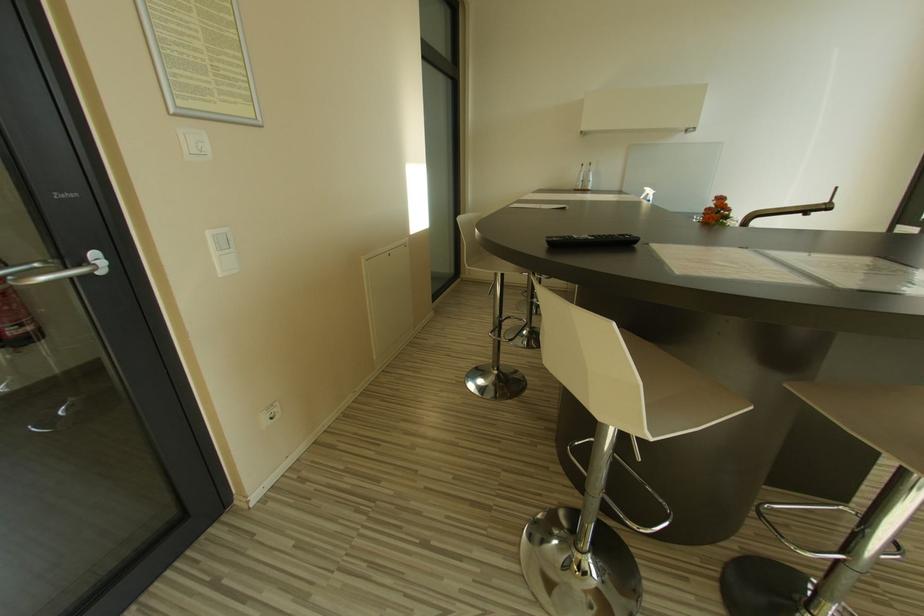
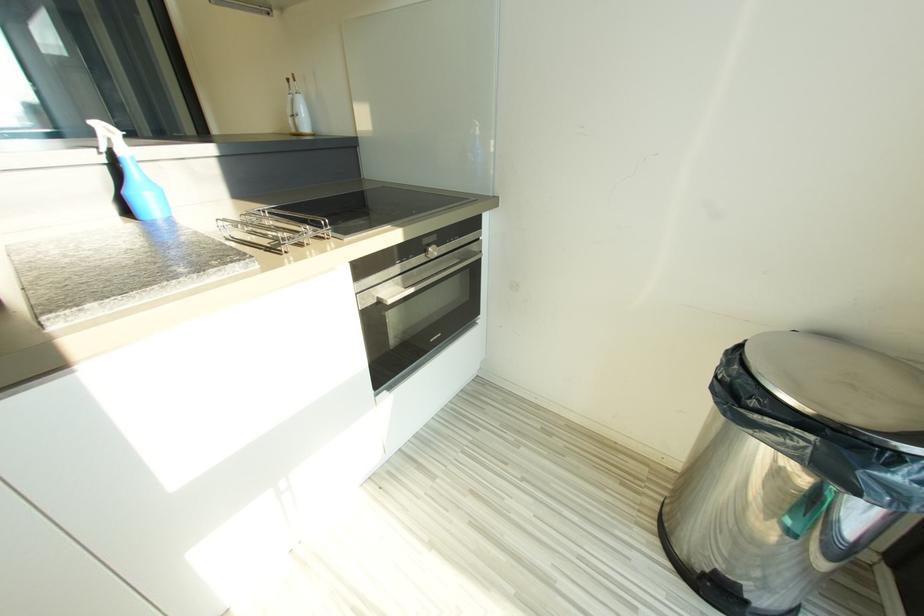
The images are taken continuously from a first-person perspective. In which direction are you moving?

The cameraman walked toward right, forward.